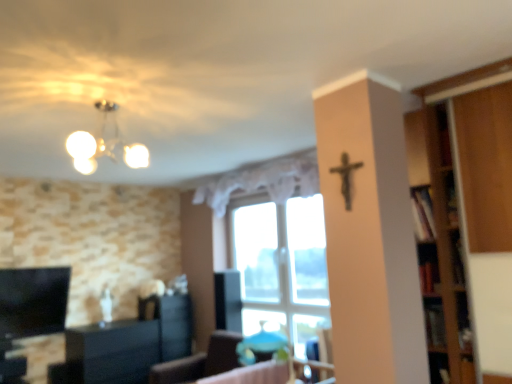
Question: Is black matte crucifix at upper center shorter than white lace curtain at center?

Choices:
 (A) yes
 (B) no

Answer: (A)

Question: Is white lace curtain at center at the back of black matte crucifix at upper center?

Choices:
 (A) yes
 (B) no

Answer: (B)

Question: From a real-world perspective, is black matte crucifix at upper center beneath white lace curtain at center?

Choices:
 (A) no
 (B) yes

Answer: (B)

Question: From the image's perspective, would you say black matte crucifix at upper center is shown under white lace curtain at center?

Choices:
 (A) no
 (B) yes

Answer: (A)

Question: Is black matte crucifix at upper center facing towards white lace curtain at center?

Choices:
 (A) no
 (B) yes

Answer: (A)

Question: Can we say black matte crucifix at upper center lies outside white lace curtain at center?

Choices:
 (A) yes
 (B) no

Answer: (A)

Question: From a real-world perspective, is matte blue chair at center positioned over black glossy cabinet at lower left based on gravity?

Choices:
 (A) no
 (B) yes

Answer: (A)

Question: Can you confirm if matte blue chair at center is positioned to the left of black glossy cabinet at lower left?

Choices:
 (A) no
 (B) yes

Answer: (A)

Question: Is matte blue chair at center taller than black glossy cabinet at lower left?

Choices:
 (A) yes
 (B) no

Answer: (B)

Question: From the image's perspective, is matte blue chair at center above black glossy cabinet at lower left?

Choices:
 (A) yes
 (B) no

Answer: (A)

Question: Is matte blue chair at center facing away from black glossy cabinet at lower left?

Choices:
 (A) yes
 (B) no

Answer: (B)

Question: Does matte blue chair at center turn towards black glossy cabinet at lower left?

Choices:
 (A) yes
 (B) no

Answer: (B)

Question: Is matte white chandelier at upper left outside of white lace curtain at center?

Choices:
 (A) no
 (B) yes

Answer: (B)